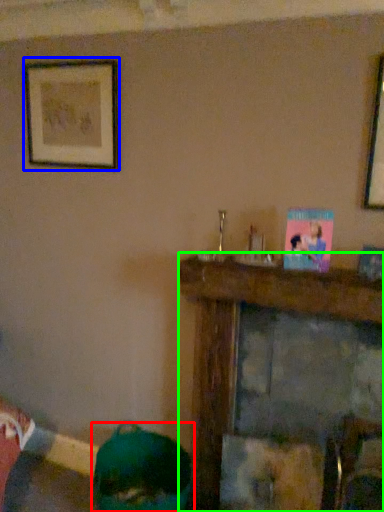
Question: Which object is positioned closest to person (highlighted by a red box)? Select from picture frame (highlighted by a blue box) and furniture (highlighted by a green box).

Choices:
 (A) picture frame
 (B) furniture

Answer: (B)